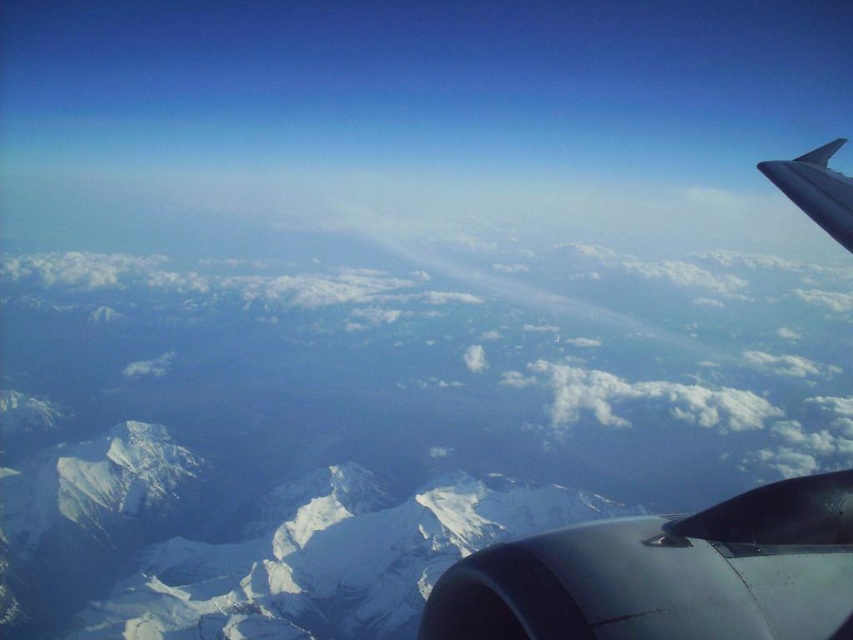
Who is shorter, white snow-covered mountain range at center or metallic gray engine at lower right?

metallic gray engine at lower right is shorter.

Who is lower down, white snow-covered mountain range at center or metallic gray engine at lower right?

Positioned lower is white snow-covered mountain range at center.

Locate an element on the screen. This screenshot has height=640, width=853. white snow-covered mountain range at center is located at coordinates (241, 544).

Can you confirm if white snow-covered mountain range at center is bigger than silver metallic wing at upper right?

Yes.

Is white snow-covered mountain range at center thinner than silver metallic wing at upper right?

Incorrect, white snow-covered mountain range at center's width is not less than silver metallic wing at upper right's.

This screenshot has width=853, height=640. What do you see at coordinates (241, 544) in the screenshot?
I see `white snow-covered mountain range at center` at bounding box center [241, 544].

The width and height of the screenshot is (853, 640). Find the location of `white snow-covered mountain range at center`. white snow-covered mountain range at center is located at coordinates (241, 544).

Can you confirm if metallic gray engine at right is positioned to the left of metallic gray engine at lower right?

Incorrect, metallic gray engine at right is not on the left side of metallic gray engine at lower right.

Who is higher up, metallic gray engine at right or metallic gray engine at lower right?

metallic gray engine at lower right is above.

Locate an element on the screen. The image size is (853, 640). metallic gray engine at right is located at coordinates (666, 573).

This screenshot has height=640, width=853. In order to click on metallic gray engine at right in this screenshot , I will do `click(666, 573)`.